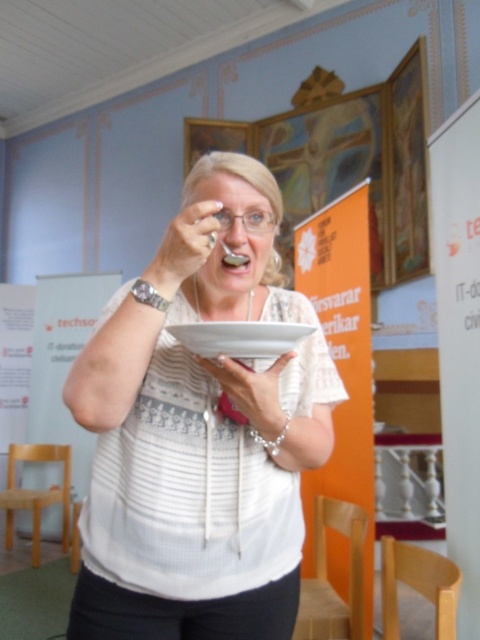
You are a chef preparing a dish and need to choose between the white matte bowl at center and the white glossy plate at center. Which one has a bigger capacity for holding ingredients?

The white matte bowl at center has a larger capacity than the white glossy plate at center because it is larger in size.